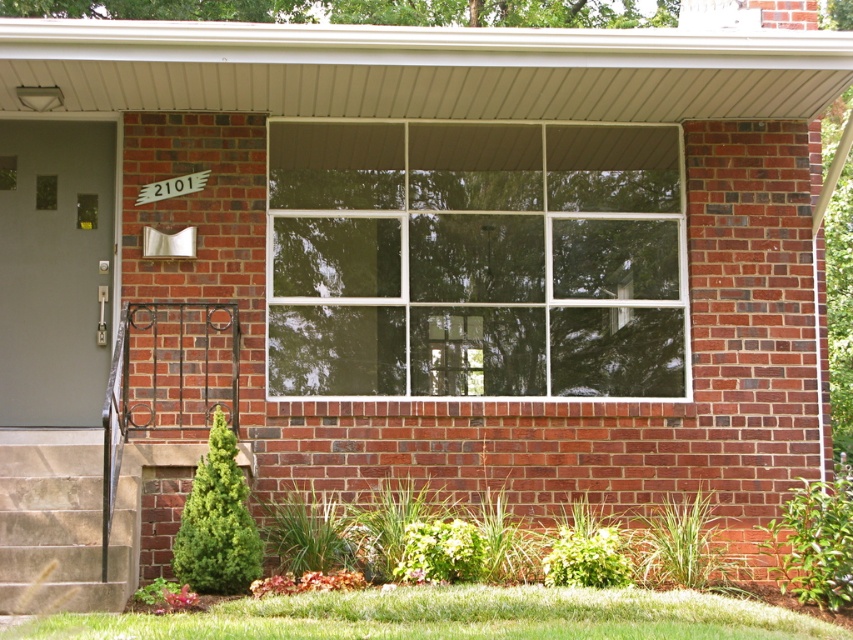
Can you confirm if stone stairs at lower left is positioned above white plastic street sign at upper center?

No.

Between stone stairs at lower left and white plastic street sign at upper center, which one has less height?

white plastic street sign at upper center

Which is behind, point (20, 589) or point (149, 188)?

The point (149, 188) is more distant.

The image size is (853, 640). What are the coordinates of `stone stairs at lower left` in the screenshot? It's located at (64, 520).

Does white glass window at center appear under stone stairs at lower left?

No.

Can you confirm if white glass window at center is positioned to the left of stone stairs at lower left?

In fact, white glass window at center is to the right of stone stairs at lower left.

Which is in front, point (306, 358) or point (120, 515)?

Point (120, 515)

You are a GUI agent. You are given a task and a screenshot of the screen. Output one action in this format:
    pyautogui.click(x=<x>, y=<y>)
    Task: Click on the white glass window at center
    This screenshot has width=853, height=640.
    Given the screenshot: What is the action you would take?
    pyautogui.click(x=474, y=259)

Who is higher up, white glass window at center or white plastic street sign at upper center?

white plastic street sign at upper center is above.

What do you see at coordinates (474, 259) in the screenshot?
I see `white glass window at center` at bounding box center [474, 259].

At what (x,y) coordinates should I click in order to perform the action: click on white glass window at center. Please return your answer as a coordinate pair (x, y). Image resolution: width=853 pixels, height=640 pixels. Looking at the image, I should click on (474, 259).